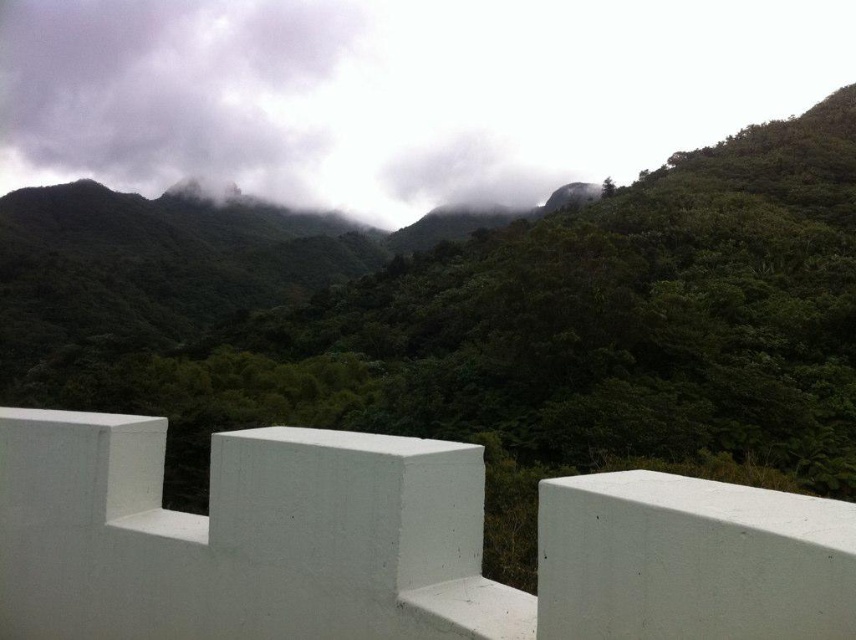
Question: Where is green matte forest at upper center located in relation to dark gray cloud at upper left in the image?

Choices:
 (A) left
 (B) right

Answer: (B)

Question: Which of the following is the farthest from the observer?

Choices:
 (A) (446, 419)
 (B) (159, 116)

Answer: (B)

Question: Can you confirm if green matte forest at upper center is wider than dark gray cloud at upper left?

Choices:
 (A) no
 (B) yes

Answer: (B)

Question: In this image, where is green matte forest at upper center located relative to dark gray cloud at upper left?

Choices:
 (A) below
 (B) above

Answer: (A)

Question: Which point is closer to the camera taking this photo?

Choices:
 (A) (839, 484)
 (B) (128, 60)

Answer: (A)